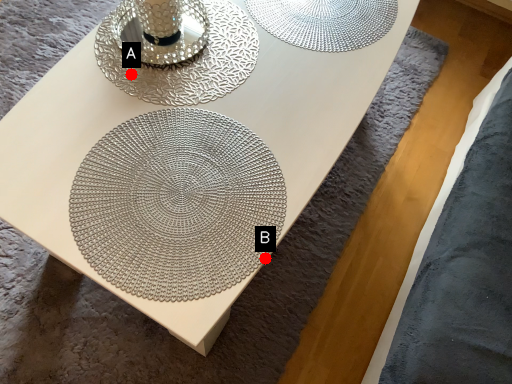
Question: Two points are circled on the image, labeled by A and B beside each circle. Which of the following is the farthest from the observer?

Choices:
 (A) A is further
 (B) B is further

Answer: (A)